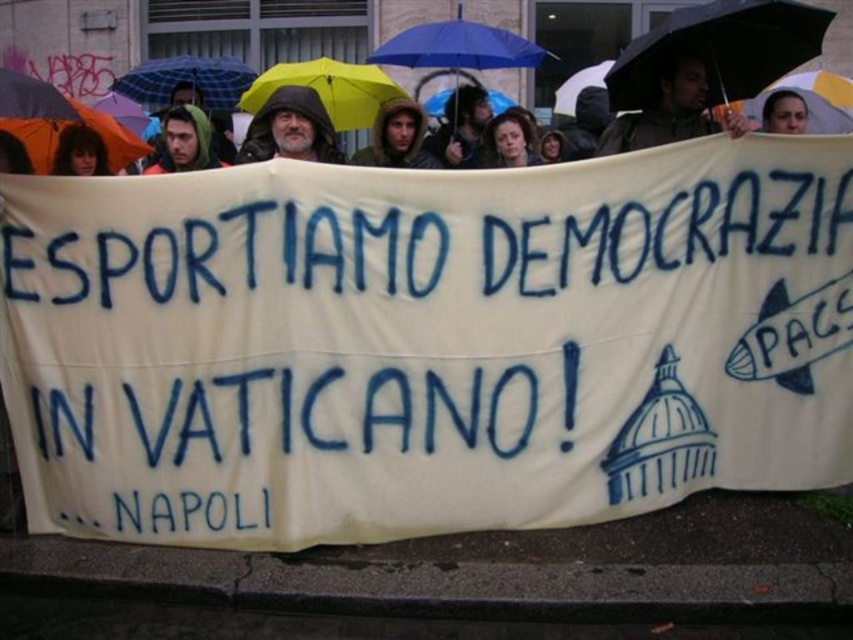
You are a photographer trying to capture a clear shot of the green hooded jacket at center without the blue plaid umbrella at upper center blocking it. Since the umbrella is shorter than the jacket, can you adjust your camera angle to avoid the umbrella?

The blue plaid umbrella at upper center is shorter than the green hooded jacket at center, so adjusting the camera angle to focus higher on the jacket should allow you to avoid the umbrella.

You are a photographer at the protest scene. You need to capture a photo where both the blue plaid umbrella at upper center and the matte black hair at lower left are visible. Considering their widths, which object should be placed closer to the edge of the frame to ensure both fit in the shot?

The blue plaid umbrella at upper center is wider than the matte black hair at lower left. To ensure both fit in the frame, position the wider blue plaid umbrella at upper center closer to the edge so it doesn

Looking at this image, you are a photographer at the protest. You want to capture a photo that includes both the blue plaid umbrella at upper center and the matte black hair at lower left. Based on their positions, which object should you focus on first to ensure both are in frame?

The blue plaid umbrella at upper center is located above matte black hair at lower left. To include both in the frame, focus on the blue plaid umbrella at upper center first as it is higher up, allowing the matte black hair at lower left to naturally fall into the lower portion of the photo.